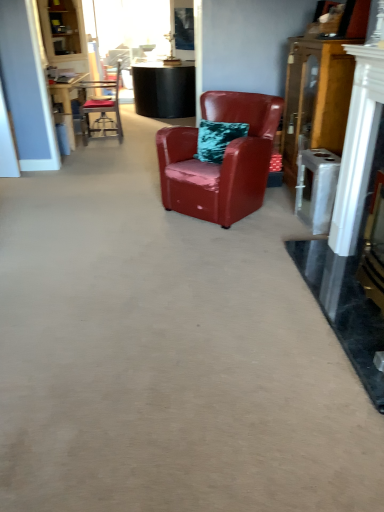
Where is `space that is in front of glossy leather armchair at center, which is the first chair in right-to-left order`? space that is in front of glossy leather armchair at center, which is the first chair in right-to-left order is located at coordinates (215, 246).